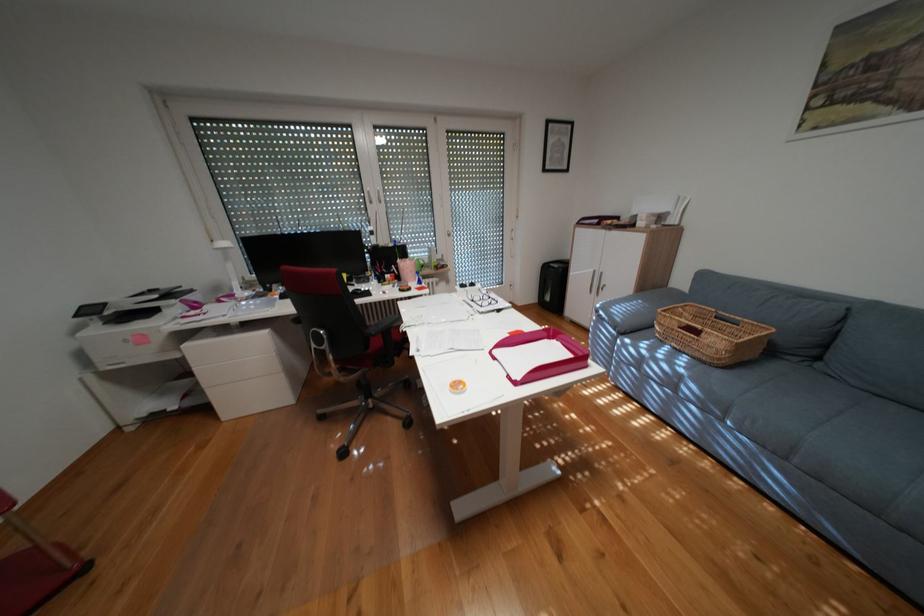
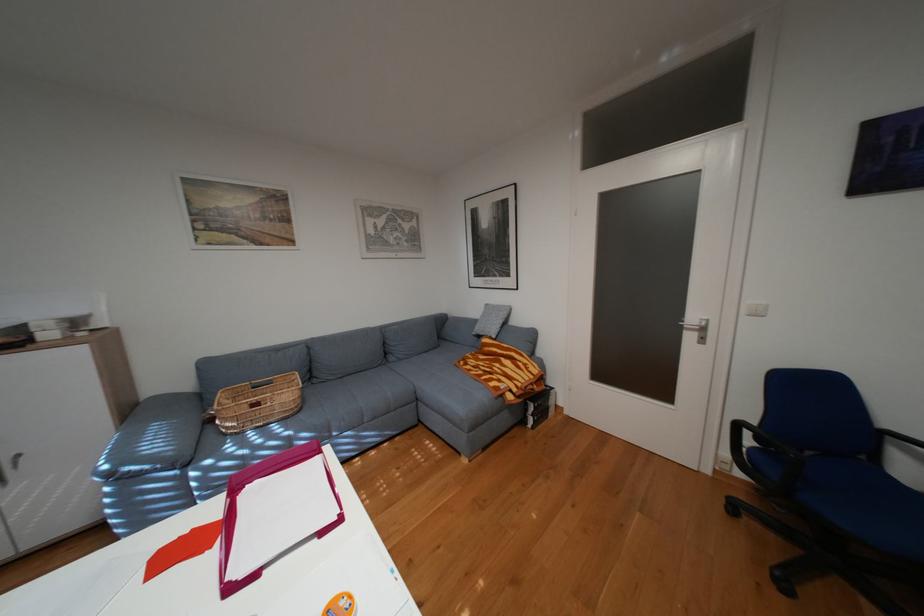
Question: How did the camera likely rotate?

Choices:
 (A) Left
 (B) Right
 (C) Up
 (D) Down

Answer: (B)